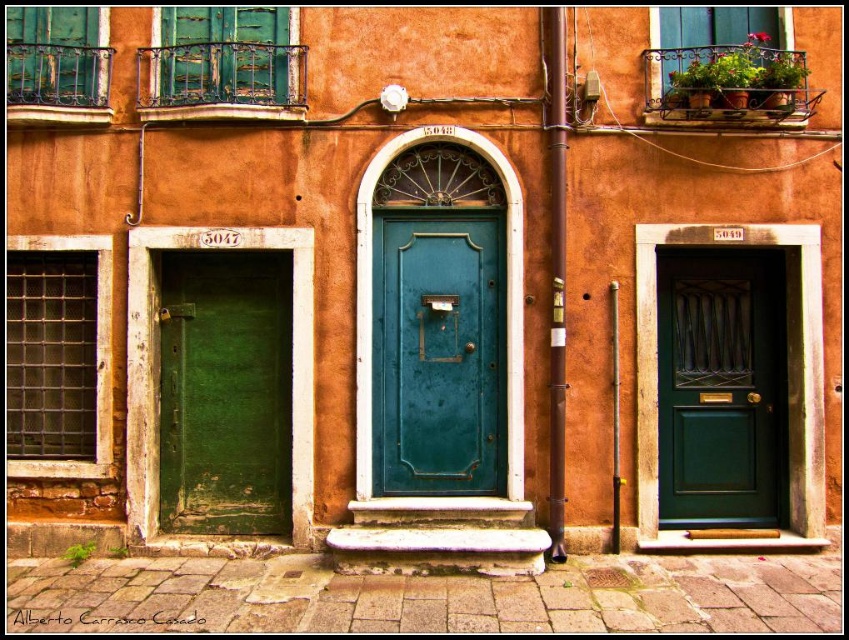
Is teal matte door at center bigger than green matte door at left?

Actually, teal matte door at center might be smaller than green matte door at left.

Who is more distant from viewer, (414, 417) or (209, 253)?

The point (209, 253) is behind.

Image resolution: width=849 pixels, height=640 pixels. Identify the location of teal matte door at center. (437, 352).

What do you see at coordinates (437, 352) in the screenshot?
I see `teal matte door at center` at bounding box center [437, 352].

Which is behind, point (442, 417) or point (687, 488)?

The point (687, 488) is more distant.

I want to click on teal matte door at center, so click(437, 352).

Is green matte door at left closer to the viewer compared to green matte door at center?

Yes, green matte door at left is in front of green matte door at center.

Does green matte door at left have a lesser width compared to green matte door at center?

In fact, green matte door at left might be wider than green matte door at center.

Between point (274, 362) and point (724, 470), which one is positioned in front?

Positioned in front is point (274, 362).

Locate an element on the screen. The width and height of the screenshot is (849, 640). green matte door at left is located at coordinates (223, 392).